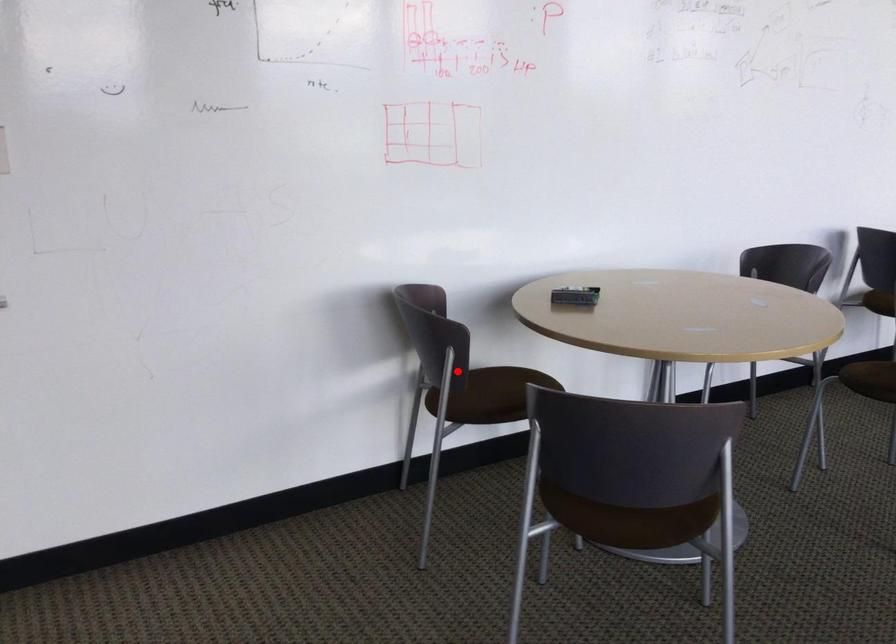
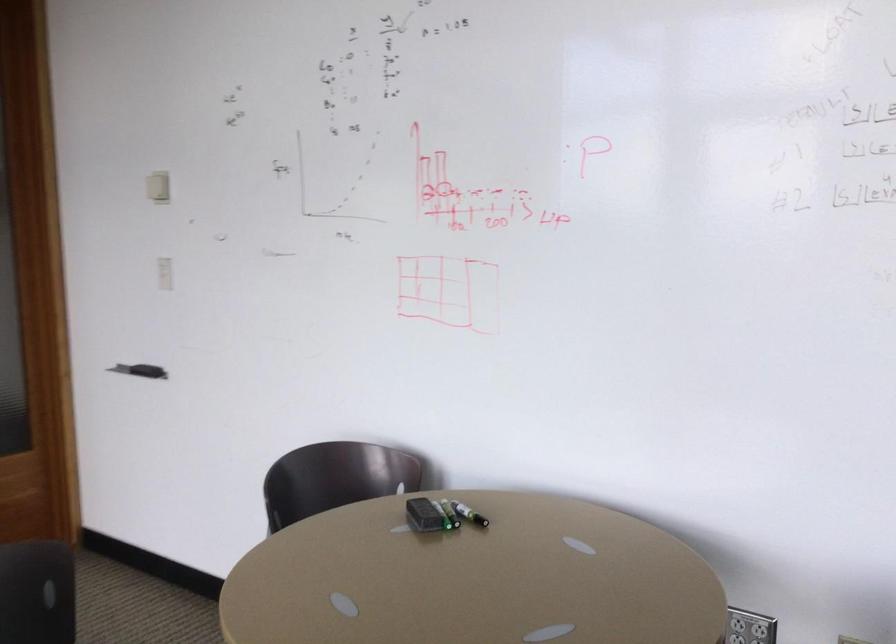
Question: I am providing you with two images of the same scene from different viewpoints. A red point is marked on the first image. Can you still see the location of the red point in image 2?

Choices:
 (A) Yes
 (B) No

Answer: (B)